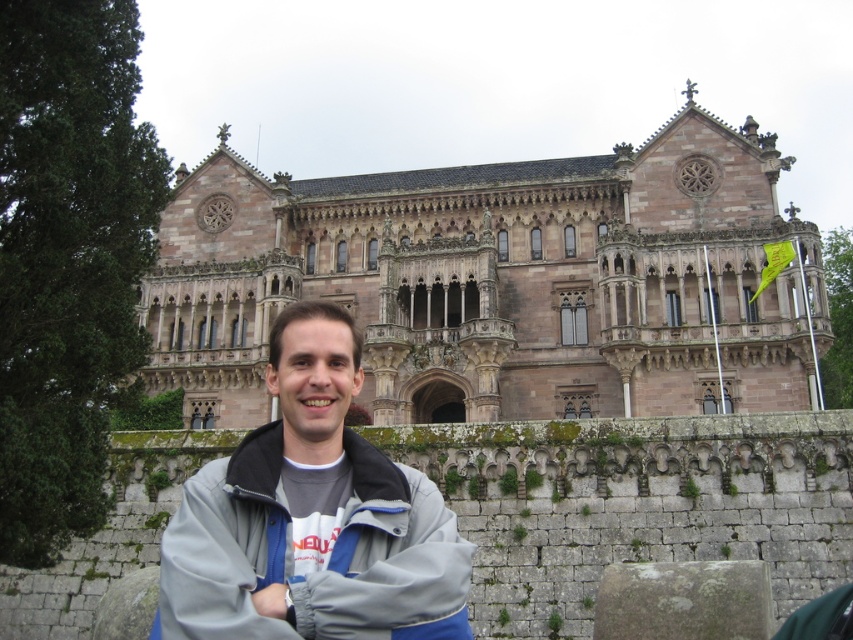
Question: Estimate the real-world distances between objects in this image. Which object is closer to the gray fleece jacket at center?

Choices:
 (A) gray fleece jacket at lower center
 (B) brown stone building at center

Answer: (A)

Question: Can you confirm if gray fleece jacket at center is positioned to the left of gray fleece jacket at lower center?

Choices:
 (A) no
 (B) yes

Answer: (A)

Question: Can you confirm if gray fleece jacket at center is smaller than gray fleece jacket at lower center?

Choices:
 (A) yes
 (B) no

Answer: (B)

Question: Is brown stone building at center bigger than gray fleece jacket at lower center?

Choices:
 (A) yes
 (B) no

Answer: (A)

Question: Which of the following is the closest to the observer?

Choices:
 (A) brown stone building at center
 (B) gray fleece jacket at center

Answer: (B)

Question: Which point is closer to the camera taking this photo?

Choices:
 (A) (798, 352)
 (B) (183, 496)
 (C) (310, 490)

Answer: (B)